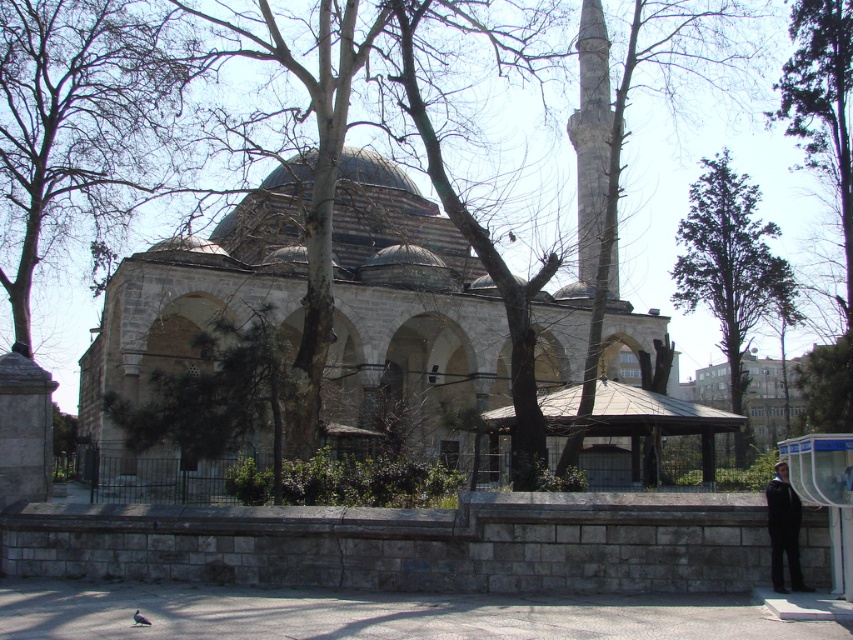
You are planning to place a new bench in the garden area near the mosque. The bench requires a space wider than the green leafy tree at right. Can the brown wooden gazebo at lower right provide enough space for the bench?

The green leafy tree at right has a lesser width compared to the brown wooden gazebo at lower right, so the brown wooden gazebo at lower right can provide enough space for the bench since it is wider than the tree.

You are standing in front of the mosque and want to take a photo of the brown wooden gazebo at lower right without any trees in the frame. Which direction should you move to ensure the green leafy tree at right is no longer blocking the view?

Move to the left side of the brown wooden gazebo at lower right so that the green leafy tree at right is no longer blocking the view.